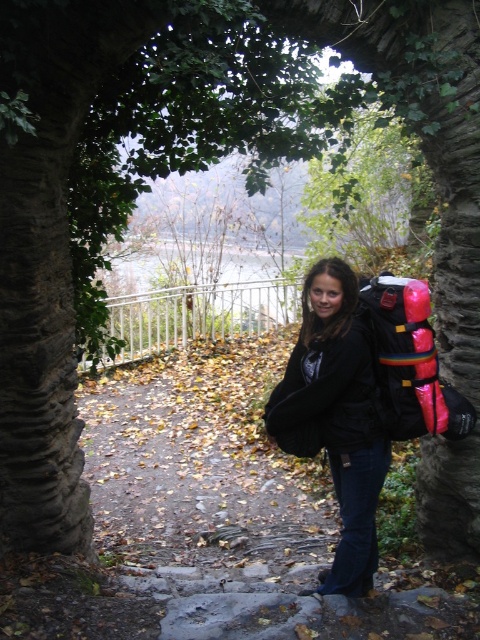
Question: Does black matte jacket at center have a greater width compared to rubberized pink backpack at right?

Choices:
 (A) no
 (B) yes

Answer: (A)

Question: Which object is farther from the camera taking this photo?

Choices:
 (A) black matte jacket at center
 (B) rubberized pink backpack at right

Answer: (B)

Question: In this image, where is black matte jacket at center located relative to rubberized pink backpack at right?

Choices:
 (A) left
 (B) right

Answer: (A)

Question: Does black matte jacket at center lie behind rubberized pink backpack at right?

Choices:
 (A) yes
 (B) no

Answer: (B)